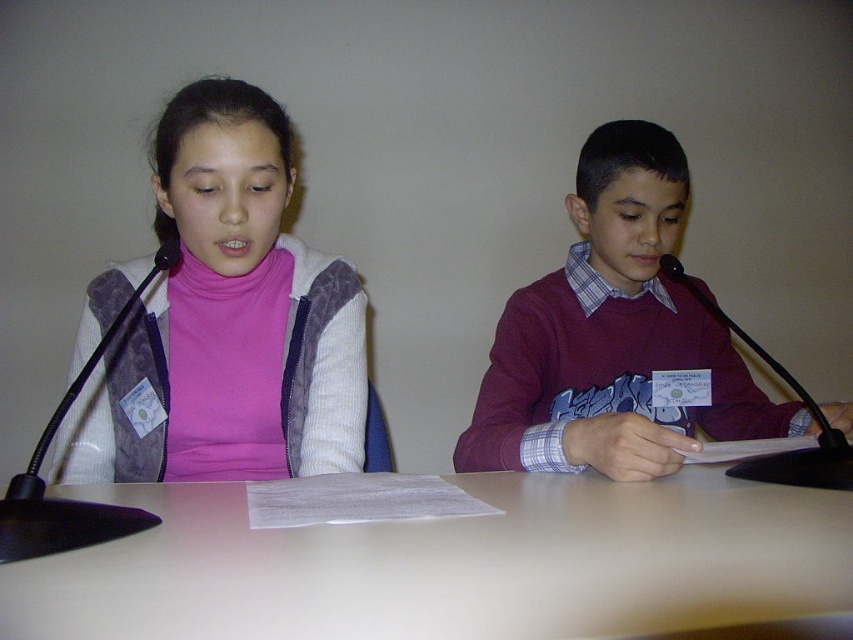
You are organizing a small event and need to place a 1.2 meter wide banner between the white matte table at center and the pink fleece sweater at left. Based on their sizes, will the banner fit comfortably between them?

The white matte table at center is smaller in size than the pink fleece sweater at left. However, since the banner is 1.2 meters wide, it might not fit comfortably between them if the space between the two objects is insufficient. Please measure the actual distance first.

You are a photographer setting up for a school event. You need to place a 12 inch tall trophy on the table so that it is visible to everyone in the audience. Given the white matte table at center and maroon sweater at center, will the trophy be tall enough to be seen over the table?

The white matte table at center is shorter than maroon sweater at center. Since the trophy is 12 inches tall, it needs to be placed on the table so that its height exceeds the table height. However, the description states the table is shorter than the sweater, but we donot know the sweater height. Therefore, we cannot determine if the trophy will be visible.

In the scene shown: You are a photographer setting up for a live stream. You need to position your camera so it can capture both the young girl in pink turtleneck sweater and the young boy in maroon long sleeve without moving the camera. The camera is currently placed 17.37 inches away from the white matte table at center. Is the camera positioned far enough to capture both individuals?

The camera is 17.37 inches away from the white matte table at center, which is the distance between the camera and the table. Since both the young girl in pink turtleneck sweater and the young boy in maroon long sleeve are seated at the table, the camera should be positioned far enough to capture both individuals as they are likely within the camera frame at that distance.